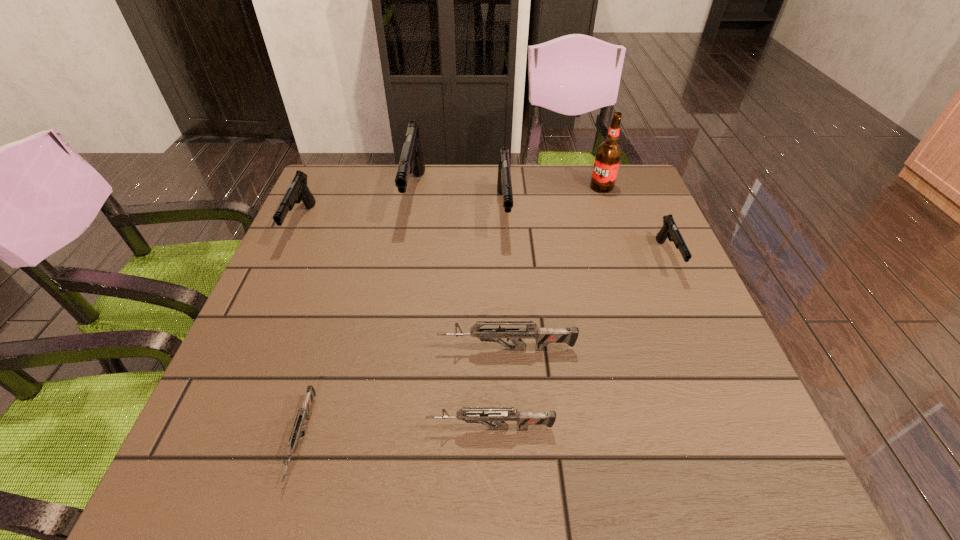
The image size is (960, 540). Find the location of `unoccupied position between the root beer and the biggest grey gun`. unoccupied position between the root beer and the biggest grey gun is located at coordinates (554, 268).

Where is `free space between the sixth shortest object and the seventh tallest object`? The width and height of the screenshot is (960, 540). free space between the sixth shortest object and the seventh tallest object is located at coordinates (497, 320).

Locate an element on the screen. This screenshot has height=540, width=960. unoccupied position between the sixth tallest gun and the rightmost black gun is located at coordinates click(x=579, y=343).

Where is `vacant space that is in between the biggest black gun and the rightmost black gun`? The width and height of the screenshot is (960, 540). vacant space that is in between the biggest black gun and the rightmost black gun is located at coordinates (540, 227).

The width and height of the screenshot is (960, 540). I want to click on free space between the sixth farthest object and the sixth shortest gun, so click(x=505, y=281).

Where is `vacant area that lies between the smallest black gun and the second biggest black gun`? vacant area that lies between the smallest black gun and the second biggest black gun is located at coordinates (586, 235).

The image size is (960, 540). I want to click on free space between the third smallest black gun and the sixth tallest gun, so click(497, 320).

You are a GUI agent. You are given a task and a screenshot of the screen. Output one action in this format:
    pyautogui.click(x=<x>, y=<y>)
    Task: Click on the empty space that is in between the biggest grey gun and the sixth shortest gun
    Image resolution: width=960 pixels, height=540 pixels.
    Given the screenshot: What is the action you would take?
    pyautogui.click(x=505, y=281)

This screenshot has width=960, height=540. Identify the location of vacant area that lies between the second smallest black gun and the farthest grey gun. (404, 286).

The height and width of the screenshot is (540, 960). I want to click on object that stands as the seventh closest to the third biggest black gun, so click(669, 230).